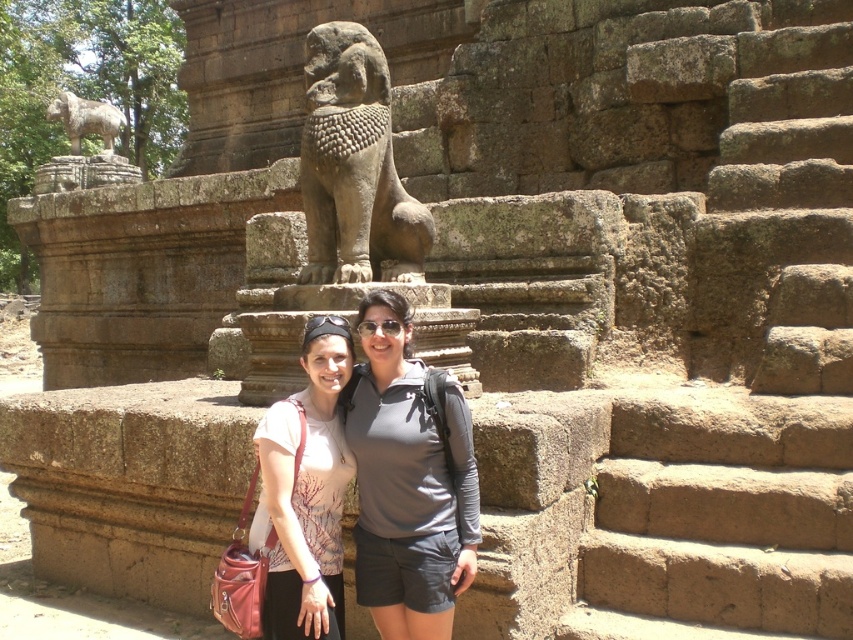
Image resolution: width=853 pixels, height=640 pixels. What do you see at coordinates (354, 164) in the screenshot?
I see `gray stone lion at center` at bounding box center [354, 164].

Can you confirm if gray stone lion at center is shorter than matte white blouse at center?

No, gray stone lion at center is not shorter than matte white blouse at center.

Is point (363, 202) positioned behind point (299, 520)?

Yes, point (363, 202) is behind point (299, 520).

Locate an element on the screen. Image resolution: width=853 pixels, height=640 pixels. gray stone lion at center is located at coordinates (354, 164).

Who is more distant from viewer, (409, 614) or (376, 97)?

The point (376, 97) is more distant.

Is point (368, 465) positioned before point (367, 172)?

Yes, it is in front of point (367, 172).

In order to click on gray matte shirt at center in this screenshot , I will do `click(408, 477)`.

Which is more to the right, matte white blouse at center or gray stone lion at upper left?

Positioned to the right is matte white blouse at center.

Does point (325, 493) come in front of point (115, 122)?

Yes, it is.

Is point (306, 444) farther from camera compared to point (50, 112)?

No, (306, 444) is in front of (50, 112).

Locate an element on the screen. The width and height of the screenshot is (853, 640). matte white blouse at center is located at coordinates (306, 492).